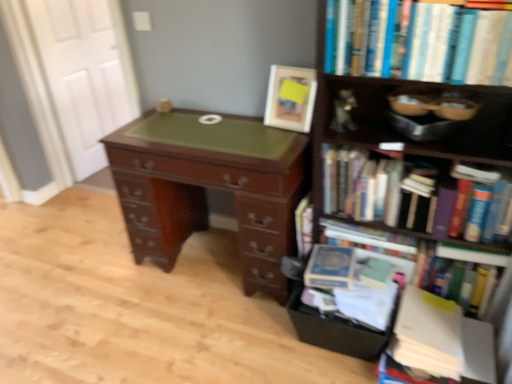
Consider the image. What is the approximate width of blue cardboard magazine at lower right?

blue cardboard magazine at lower right is 12.52 inches in width.

Locate an element on the screen. This screenshot has width=512, height=384. blue cardboard magazine at lower right is located at coordinates (354, 283).

What is the approximate height of hardcover book at right, positioned as the second book in bottom-to-top order?

hardcover book at right, positioned as the second book in bottom-to-top order, is 34.02 centimeters tall.

This screenshot has height=384, width=512. What are the coordinates of `hardcover book at center, the 3th book when ordered from bottom to top` in the screenshot? It's located at (304, 226).

Image resolution: width=512 pixels, height=384 pixels. What are the coordinates of `hardcover books at right, the 2th book viewed from the top` in the screenshot? It's located at click(386, 191).

What is the approximate height of black cardboard drawer at lower right?

8.12 inches.

Locate an element on the screen. white paper stack at lower right, the 5th book when ordered from top to bottom is located at coordinates (428, 334).

Locate an element on the screen. hardcover books at upper right, which appears as the 1th book when viewed from the top is located at coordinates click(418, 42).

This screenshot has height=384, width=512. In order to click on blue cardboard magazine at lower right in this screenshot , I will do `click(354, 283)`.

Which of these two, hardcover books at upper right, which appears as the 1th book when viewed from the top, or hardcover book at right, positioned as the second book in bottom-to-top order, stands taller?

Standing taller between the two is hardcover book at right, positioned as the second book in bottom-to-top order.

Relative to hardcover book at right, which appears as the fourth book when viewed from the top, is hardcover books at upper right, which appears as the 1th book when viewed from the top, in front or behind?

In the image, hardcover books at upper right, which appears as the 1th book when viewed from the top, appears in front of hardcover book at right, which appears as the fourth book when viewed from the top.

From the image's perspective, is hardcover books at upper right, which appears as the 5th book when ordered from the bottom, located beneath hardcover book at right, which appears as the fourth book when viewed from the top?

Incorrect, from the image's perspective, hardcover books at upper right, which appears as the 5th book when ordered from the bottom, is higher than hardcover book at right, which appears as the fourth book when viewed from the top.

Is hardcover books at upper right, which appears as the 5th book when ordered from the bottom, smaller than hardcover book at right, which appears as the fourth book when viewed from the top?

Correct, hardcover books at upper right, which appears as the 5th book when ordered from the bottom, occupies less space than hardcover book at right, which appears as the fourth book when viewed from the top.

From the image's perspective, does blue cardboard magazine at lower right appear lower than black cardboard drawer at lower right?

No, from the image's perspective, blue cardboard magazine at lower right is not beneath black cardboard drawer at lower right.

Is blue cardboard magazine at lower right bigger or smaller than black cardboard drawer at lower right?

In the image, blue cardboard magazine at lower right appears to be larger than black cardboard drawer at lower right.

Find the location of `drawer that appears below the blue cardboard magazine at lower right (from the image's perspective)`. drawer that appears below the blue cardboard magazine at lower right (from the image's perspective) is located at coordinates (334, 330).

Is blue cardboard magazine at lower right to the right of black cardboard drawer at lower right from the viewer's perspective?

Incorrect, blue cardboard magazine at lower right is not on the right side of black cardboard drawer at lower right.

From the image's perspective, between hardcover book at right, positioned as the second book in bottom-to-top order, and hardcover books at right, which is the 4th book from bottom to top, which one is located above?

From the image's view, hardcover books at right, which is the 4th book from bottom to top, is above.

Does hardcover book at right, positioned as the second book in bottom-to-top order, have a smaller size compared to hardcover books at right, the 2th book viewed from the top?

No.

Does point (359, 230) appear closer or farther from the camera than point (328, 185)?

Point (359, 230).

Can you confirm if hardcover book at right, which appears as the fourth book when viewed from the top, is shorter than hardcover books at right, the 2th book viewed from the top?

Incorrect, the height of hardcover book at right, which appears as the fourth book when viewed from the top, does not fall short of that of hardcover books at right, the 2th book viewed from the top.

Can you confirm if wooden bookcase at right is thinner than hardcover books at upper right, which appears as the 5th book when ordered from the bottom?

Incorrect, the width of wooden bookcase at right is not less than that of hardcover books at upper right, which appears as the 5th book when ordered from the bottom.

From the image's perspective, is wooden bookcase at right located above or below hardcover books at upper right, which appears as the 5th book when ordered from the bottom?

wooden bookcase at right is below hardcover books at upper right, which appears as the 5th book when ordered from the bottom.

Does point (480, 367) come behind point (332, 9)?

Yes, it is.

Is wooden bookcase at right oriented towards hardcover books at upper right, which appears as the 5th book when ordered from the bottom?

Yes, wooden bookcase at right is oriented towards hardcover books at upper right, which appears as the 5th book when ordered from the bottom.

Choose the correct answer: Is blue cardboard magazine at lower right inside wooden bookcase at right or outside it?

blue cardboard magazine at lower right lies outside wooden bookcase at right.

In terms of height, does blue cardboard magazine at lower right look taller or shorter compared to wooden bookcase at right?

Considering their sizes, blue cardboard magazine at lower right has less height than wooden bookcase at right.

Where is `bookcase above the blue cardboard magazine at lower right (from a real-world perspective)`? bookcase above the blue cardboard magazine at lower right (from a real-world perspective) is located at coordinates (395, 132).

From the image's perspective, which one is positioned higher, wooden bookcase at right or hardcover book at right, which appears as the fourth book when viewed from the top?

wooden bookcase at right is shown above in the image.

From the picture: Considering the sizes of wooden bookcase at right and hardcover book at right, which appears as the fourth book when viewed from the top, in the image, is wooden bookcase at right wider or thinner than hardcover book at right, which appears as the fourth book when viewed from the top,?

Clearly, wooden bookcase at right has more width compared to hardcover book at right, which appears as the fourth book when viewed from the top.

Is wooden bookcase at right facing towards hardcover book at right, positioned as the second book in bottom-to-top order?

Yes, wooden bookcase at right is aimed at hardcover book at right, positioned as the second book in bottom-to-top order.

Between point (348, 205) and point (362, 244), which one is positioned behind?

Point (362, 244)

Does black cardboard drawer at lower right appear on the right side of white paper stack at lower right, the 5th book when ordered from top to bottom?

Incorrect, black cardboard drawer at lower right is not on the right side of white paper stack at lower right, the 5th book when ordered from top to bottom.

Is black cardboard drawer at lower right positioned beyond the bounds of white paper stack at lower right, which appears as the 1th book when ordered from the bottom?

Yes.

What's the angular difference between black cardboard drawer at lower right and white paper stack at lower right, which appears as the 1th book when ordered from the bottom,'s facing directions?

The angle between the facing direction of black cardboard drawer at lower right and the facing direction of white paper stack at lower right, which appears as the 1th book when ordered from the bottom, is 4.63 degrees.

Starting from the black cardboard drawer at lower right, which book is the 2nd one in front? Please provide its 2D coordinates.

[(428, 334)]

What are the coordinates of `the 3rd book in front of the hardcover book at right, which appears as the fourth book when viewed from the top, starting your count from the anchor` in the screenshot? It's located at (418, 42).

In order to click on magazine above the black cardboard drawer at lower right (from a real-world perspective) in this screenshot , I will do `click(354, 283)`.

Which object lies further to the anchor point hardcover book at center, which ranks as the third book in top-to-bottom order, white paper stack at lower right, the 5th book when ordered from top to bottom, or hardcover book at right, which appears as the fourth book when viewed from the top?

white paper stack at lower right, the 5th book when ordered from top to bottom, is further to hardcover book at center, which ranks as the third book in top-to-bottom order.

Looking at the image, which one is located closer to hardcover book at center, the 3th book when ordered from bottom to top, hardcover books at right, which is the 4th book from bottom to top, or black cardboard drawer at lower right?

Based on the image, hardcover books at right, which is the 4th book from bottom to top, appears to be nearer to hardcover book at center, the 3th book when ordered from bottom to top.

Considering their positions, is blue cardboard magazine at lower right positioned further to wooden bookcase at right than mahogany wood desk at center?

mahogany wood desk at center is positioned further to the anchor wooden bookcase at right.

When comparing their distances from hardcover books at upper right, which appears as the 5th book when ordered from the bottom, does hardcover books at right, which is the 4th book from bottom to top, or blue cardboard magazine at lower right seem further?

blue cardboard magazine at lower right lies further to hardcover books at upper right, which appears as the 5th book when ordered from the bottom, than the other object.

Which object lies further to the anchor point wooden bookcase at right, hardcover books at upper right, which appears as the 1th book when viewed from the top, or mahogany wood desk at center?

mahogany wood desk at center is further to wooden bookcase at right.

From the image, which object appears to be nearer to white wood door at upper left, hardcover books at right, which is the 4th book from bottom to top, or hardcover book at center, which ranks as the third book in top-to-bottom order?

hardcover book at center, which ranks as the third book in top-to-bottom order, lies closer to white wood door at upper left than the other object.

Looking at the image, which one is located closer to white wood door at upper left, black cardboard drawer at lower right or hardcover books at right, the 2th book viewed from the top?

hardcover books at right, the 2th book viewed from the top, is closer to white wood door at upper left.

From the image, which object appears to be nearer to hardcover book at center, which ranks as the third book in top-to-bottom order, wooden bookcase at right or white wood door at upper left?

wooden bookcase at right is closer to hardcover book at center, which ranks as the third book in top-to-bottom order.

Locate an element on the screen. This screenshot has height=384, width=512. magazine situated between hardcover book at center, the 3th book when ordered from bottom to top, and hardcover books at right, which is the 4th book from bottom to top, from left to right is located at coordinates (354, 283).

What are the coordinates of `drawer situated between white wood door at upper left and wooden bookcase at right from left to right` in the screenshot? It's located at (334, 330).

Image resolution: width=512 pixels, height=384 pixels. Identify the location of bookcase between hardcover books at upper right, which appears as the 1th book when viewed from the top, and white paper stack at lower right, the 5th book when ordered from top to bottom, in the up-down direction. (395, 132).

I want to click on magazine between mahogany wood desk at center and hardcover book at right, which appears as the fourth book when viewed from the top, in the horizontal direction, so click(354, 283).